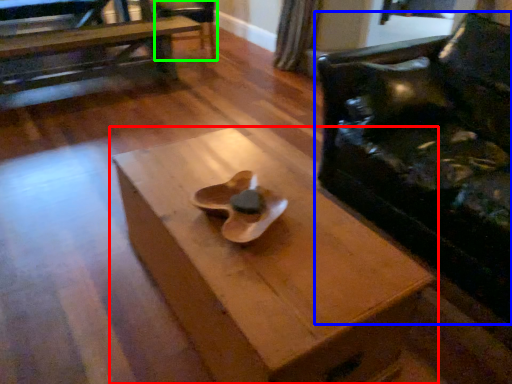
Question: Which is farther away from table (highlighted by a red box)? chair (highlighted by a blue box) or armchair (highlighted by a green box)?

Choices:
 (A) chair
 (B) armchair

Answer: (B)